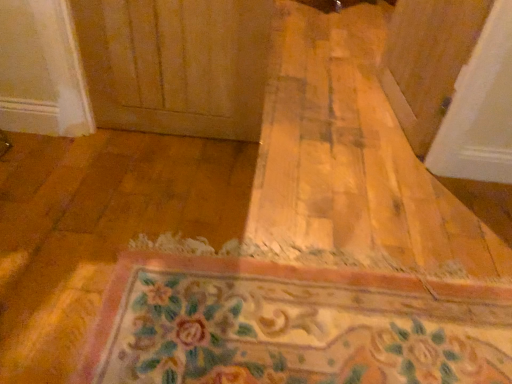
In order to face floral carpet at center, should I rotate leftwards or rightwards?

It's best to rotate right around 9.208 degrees.

What do you see at coordinates (293, 325) in the screenshot?
I see `floral carpet at center` at bounding box center [293, 325].

Where is `floral carpet at center`? floral carpet at center is located at coordinates (293, 325).

What do you see at coordinates (428, 61) in the screenshot? This screenshot has height=384, width=512. I see `transparent plastic screen door at upper right` at bounding box center [428, 61].

Image resolution: width=512 pixels, height=384 pixels. I want to click on transparent plastic screen door at upper right, so click(x=428, y=61).

This screenshot has width=512, height=384. Find the location of `floral carpet at center`. floral carpet at center is located at coordinates (293, 325).

Considering the positions of objects transparent plastic screen door at upper right and floral carpet at center in the image provided, who is more to the left, transparent plastic screen door at upper right or floral carpet at center?

floral carpet at center is more to the left.

Who is more distant, transparent plastic screen door at upper right or floral carpet at center?

transparent plastic screen door at upper right is behind.

Is point (421, 34) closer or farther from the camera than point (266, 325)?

Point (421, 34) is positioned farther from the camera compared to point (266, 325).

From the image's perspective, which one is positioned lower, transparent plastic screen door at upper right or floral carpet at center?

floral carpet at center is shown below in the image.

From a real-world perspective, is transparent plastic screen door at upper right under floral carpet at center?

No, from a real-world perspective, transparent plastic screen door at upper right is not beneath floral carpet at center.

Considering the relative sizes of transparent plastic screen door at upper right and floral carpet at center in the image provided, is transparent plastic screen door at upper right thinner than floral carpet at center?

Correct, the width of transparent plastic screen door at upper right is less than that of floral carpet at center.

Who is shorter, transparent plastic screen door at upper right or floral carpet at center?

With less height is floral carpet at center.

Looking at this image, is transparent plastic screen door at upper right smaller than floral carpet at center?

No.

Can we say transparent plastic screen door at upper right lies outside floral carpet at center?

Yes, transparent plastic screen door at upper right is located beyond the bounds of floral carpet at center.

Are transparent plastic screen door at upper right and floral carpet at center located far from each other?

That's not correct — transparent plastic screen door at upper right is a little close to floral carpet at center.

Is transparent plastic screen door at upper right oriented towards floral carpet at center?

No, transparent plastic screen door at upper right is not oriented towards floral carpet at center.

In order to click on screen door on the right of floral carpet at center in this screenshot , I will do `click(428, 61)`.

Which is more to the left, floral carpet at center or transparent plastic screen door at upper right?

From the viewer's perspective, floral carpet at center appears more on the left side.

Is floral carpet at center positioned before transparent plastic screen door at upper right?

Yes, it is.

Does point (188, 332) lie behind point (452, 85)?

No, it is in front of (452, 85).

From the image's perspective, is floral carpet at center positioned above or below transparent plastic screen door at upper right?

From the image's perspective, floral carpet at center appears below transparent plastic screen door at upper right.

From a real-world perspective, which is physically below, floral carpet at center or transparent plastic screen door at upper right?

In real-world perspective, floral carpet at center is lower.

Can you confirm if floral carpet at center is thinner than transparent plastic screen door at upper right?

No, floral carpet at center is not thinner than transparent plastic screen door at upper right.

Can you confirm if floral carpet at center is taller than transparent plastic screen door at upper right?

Incorrect, the height of floral carpet at center is not larger of that of transparent plastic screen door at upper right.

Considering the relative sizes of floral carpet at center and transparent plastic screen door at upper right in the image provided, is floral carpet at center smaller than transparent plastic screen door at upper right?

Indeed, floral carpet at center has a smaller size compared to transparent plastic screen door at upper right.

Could transparent plastic screen door at upper right be considered to be inside floral carpet at center?

No, transparent plastic screen door at upper right is not inside floral carpet at center.

Are floral carpet at center and transparent plastic screen door at upper right beside each other?

No, floral carpet at center is not with transparent plastic screen door at upper right.

Is transparent plastic screen door at upper right at the back of floral carpet at center?

That's not correct — floral carpet at center is not looking away from transparent plastic screen door at upper right.

Can you tell me how much floral carpet at center and transparent plastic screen door at upper right differ in facing direction?

99.6 degrees.

The height and width of the screenshot is (384, 512). I want to click on screen door on the right of floral carpet at center, so click(x=428, y=61).

Identify the location of bath mat that appears below the transparent plastic screen door at upper right (from the image's perspective). The image size is (512, 384). (293, 325).

Identify the location of screen door on the right side of floral carpet at center. (428, 61).